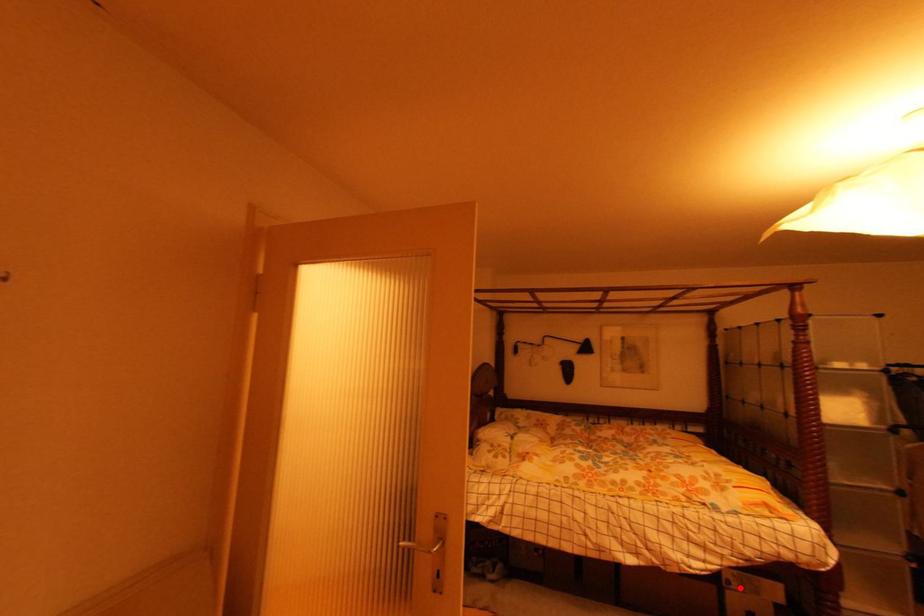
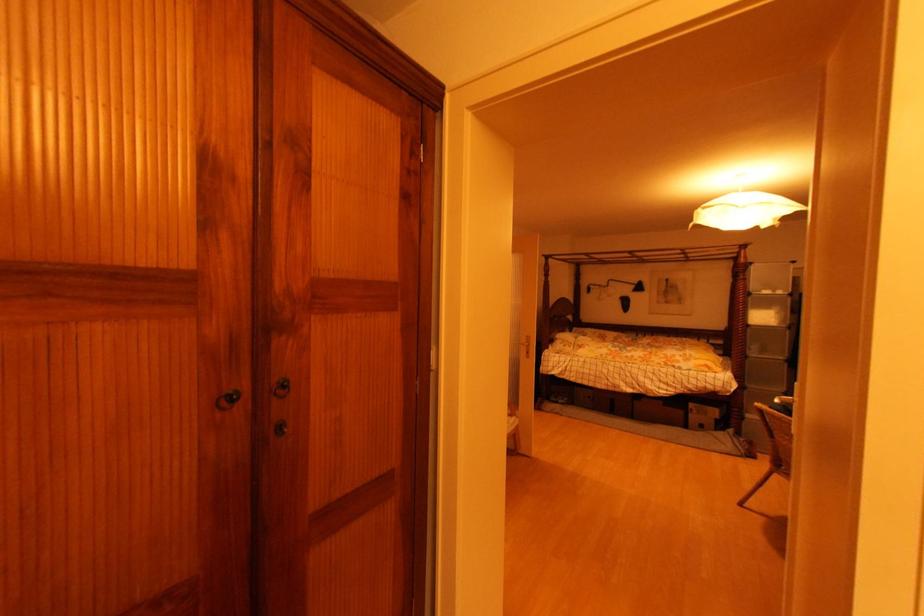
Question: I am providing you with two images of the same scene from different viewpoints. Given a red point in image1, look at the same physical point in image2. Is it:

Choices:
 (A) Closer to the viewpoint
 (B) Farther from the viewpoint

Answer: (B)